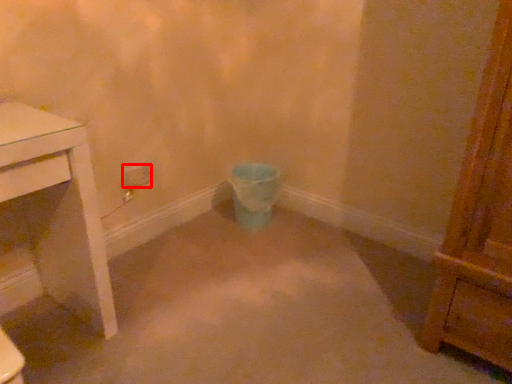
Question: Where is power plugs and sockets (annotated by the red box) located in relation to toilet bowl in the image?

Choices:
 (A) right
 (B) left

Answer: (B)